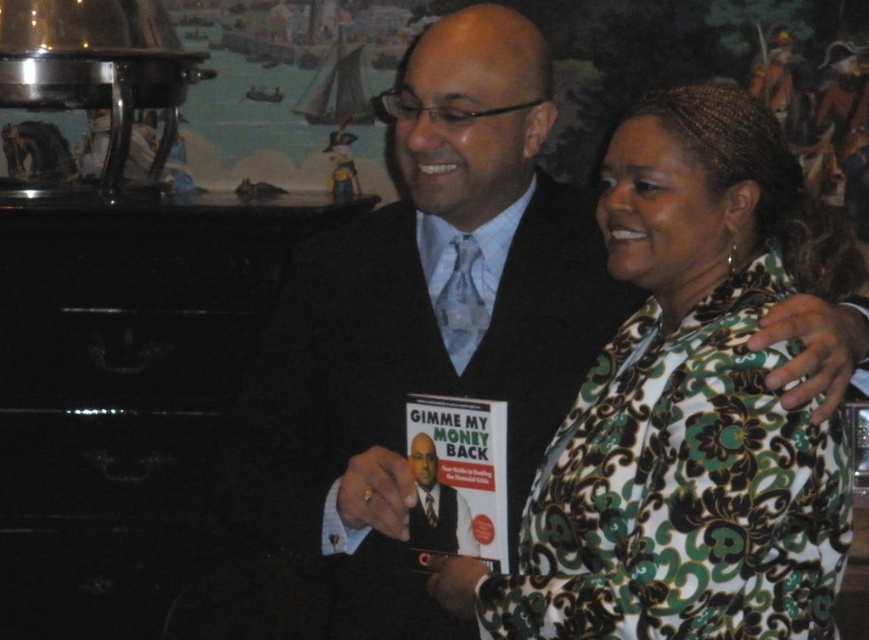
Does green floral jacket at center appear on the left side of matte black book at center?

No, green floral jacket at center is not to the left of matte black book at center.

Based on the photo, can you confirm if green floral jacket at center is smaller than matte black book at center?

Incorrect, green floral jacket at center is not smaller in size than matte black book at center.

You are a GUI agent. You are given a task and a screenshot of the screen. Output one action in this format:
    pyautogui.click(x=<x>, y=<y>)
    Task: Click on the green floral jacket at center
    
    Given the screenshot: What is the action you would take?
    pyautogui.click(x=687, y=408)

Does green floral jacket at center have a lesser height compared to matte black suit at center?

Yes, green floral jacket at center is shorter than matte black suit at center.

Can you confirm if green floral jacket at center is wider than matte black suit at center?

Incorrect, green floral jacket at center's width does not surpass matte black suit at center's.

Between point (654, 176) and point (253, 531), which one is positioned behind?

Positioned behind is point (253, 531).

Image resolution: width=869 pixels, height=640 pixels. Find the location of `green floral jacket at center`. green floral jacket at center is located at coordinates (687, 408).

Does matte black suit at center have a greater width compared to matte black book at center?

Indeed, matte black suit at center has a greater width compared to matte black book at center.

Can you confirm if matte black suit at center is positioned above matte black book at center?

Indeed, matte black suit at center is positioned over matte black book at center.

Who is more forward, [545,397] or [461,524]?

Positioned in front is point [461,524].

Identify the location of matte black suit at center. (412, 378).